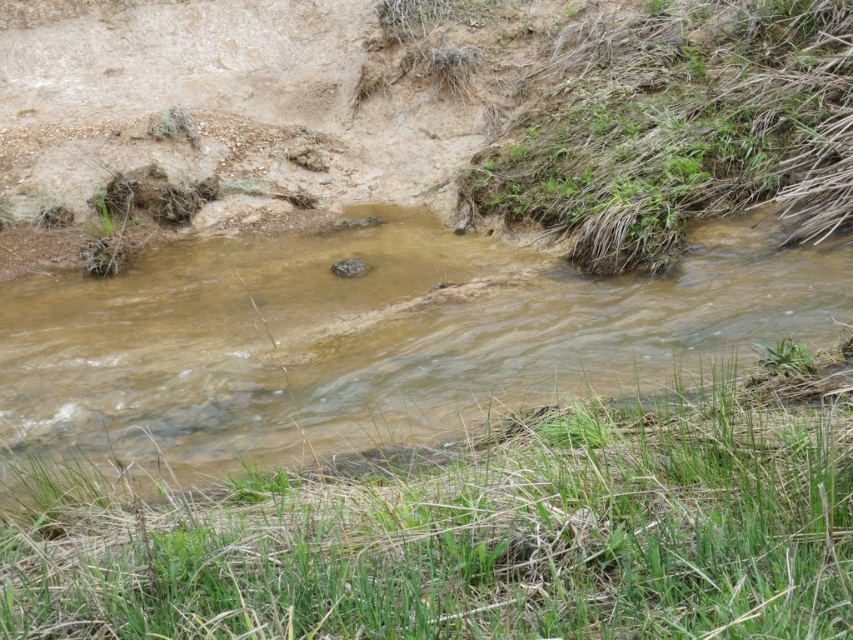
Is green grass at lower center thinner than brown muddy water at center?

No, green grass at lower center is not thinner than brown muddy water at center.

Can you confirm if green grass at lower center is positioned above brown muddy water at center?

No.

The height and width of the screenshot is (640, 853). Identify the location of green grass at lower center. (473, 529).

At what (x,y) coordinates should I click in order to perform the action: click on green grass at lower center. Please return your answer as a coordinate pair (x, y). The image size is (853, 640). Looking at the image, I should click on (473, 529).